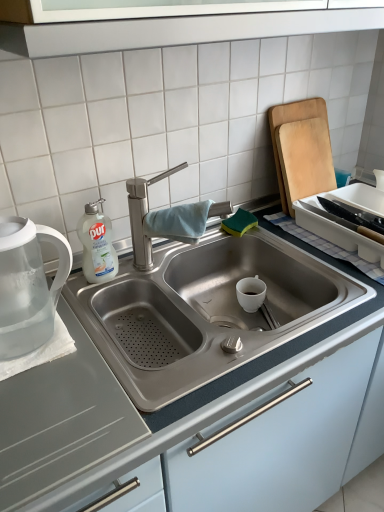
You are a GUI agent. You are given a task and a screenshot of the screen. Output one action in this format:
    pyautogui.click(x=<x>, y=<y>)
    Task: Click on the vacant area to the right of white liquid soap at left
    This screenshot has height=512, width=384.
    Given the screenshot: What is the action you would take?
    pyautogui.click(x=150, y=269)